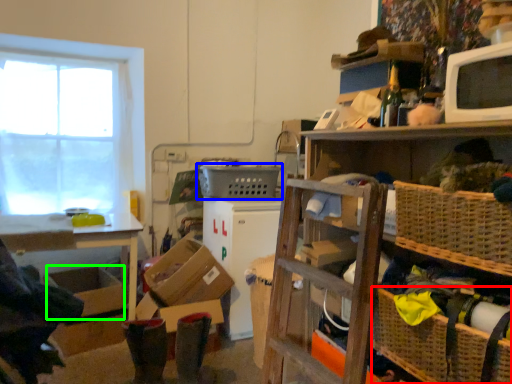
Question: Which is nearer to the basket (highlighted by a red box)? basket (highlighted by a blue box) or storage box (highlighted by a green box).

Choices:
 (A) basket
 (B) storage box

Answer: (A)